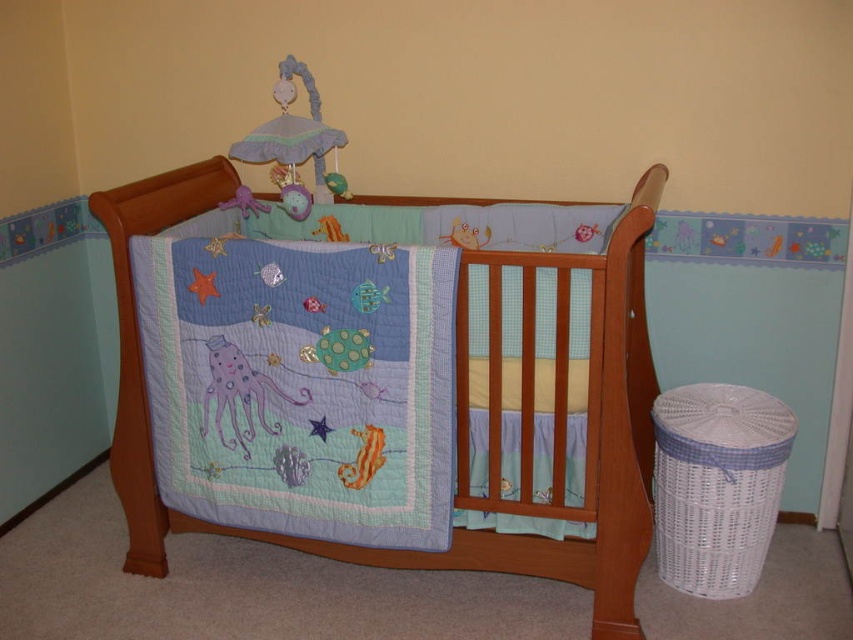
Which is behind, point (498, 317) or point (262, 406)?

Point (262, 406)

Is matte blue quilted crib at center bigger than purple fabric octopus at center?

Correct, matte blue quilted crib at center is larger in size than purple fabric octopus at center.

What do you see at coordinates (457, 406) in the screenshot?
I see `matte blue quilted crib at center` at bounding box center [457, 406].

Find the location of a particular element. matte blue quilted crib at center is located at coordinates (457, 406).

Who is lower down, pastel quilt at center or matte fabric mobile at upper center?

pastel quilt at center is below.

Is point (376, 516) positioned in front of point (293, 172)?

Yes.

Who is more distant from viewer, (430, 531) or (236, 152)?

The point (236, 152) is more distant.

At what (x,y) coordinates should I click in order to perform the action: click on pastel quilt at center. Please return your answer as a coordinate pair (x, y). Looking at the image, I should click on (300, 385).

Which is in front, point (326, 516) or point (128, 339)?

Point (326, 516) is in front.

Can you confirm if pastel quilt at center is taller than matte blue quilted crib at center?

Incorrect, pastel quilt at center's height is not larger of matte blue quilted crib at center's.

Between point (390, 300) and point (131, 556), which one is positioned in front?

Point (390, 300)

Where is `pastel quilt at center`? The width and height of the screenshot is (853, 640). pastel quilt at center is located at coordinates pyautogui.click(x=300, y=385).